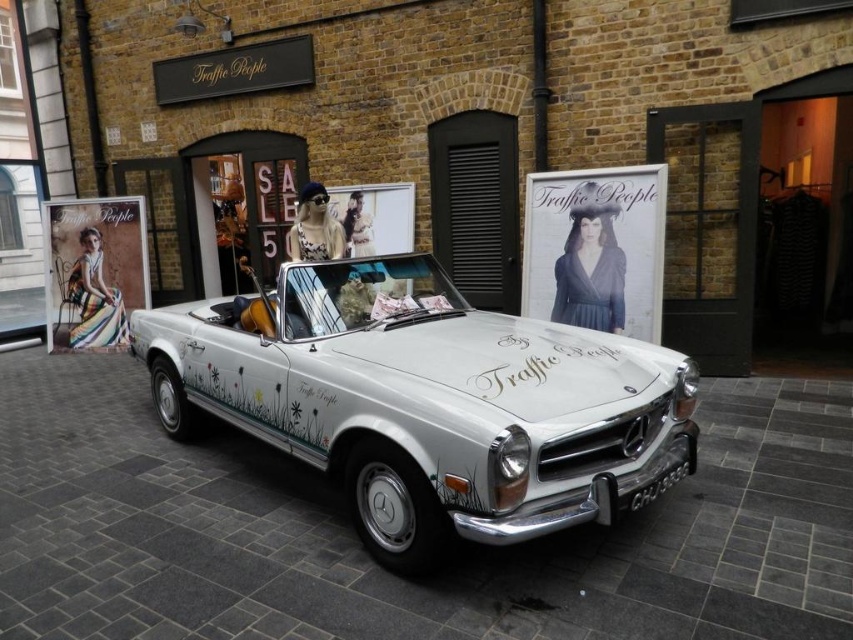
Is matte black poster at upper right positioned behind black plastic license plate at center?

That is True.

Which is below, matte black poster at upper right or black plastic license plate at center?

Positioned lower is black plastic license plate at center.

Image resolution: width=853 pixels, height=640 pixels. Identify the location of matte black poster at upper right. (596, 248).

I want to click on matte black poster at upper right, so click(596, 248).

This screenshot has width=853, height=640. I want to click on white metallic car at center, so click(x=425, y=401).

Between white metallic car at center and black plastic license plate at center, which one has more height?

white metallic car at center is taller.

At what (x,y) coordinates should I click in order to perform the action: click on white metallic car at center. Please return your answer as a coordinate pair (x, y). The height and width of the screenshot is (640, 853). Looking at the image, I should click on (425, 401).

The width and height of the screenshot is (853, 640). In order to click on white metallic car at center in this screenshot , I will do `click(425, 401)`.

Does white metallic car at center lie behind multicolored fabric dress at left?

No, white metallic car at center is in front of multicolored fabric dress at left.

Is white metallic car at center below multicolored fabric dress at left?

Yes, white metallic car at center is below multicolored fabric dress at left.

Is point (339, 464) behind point (144, 300)?

No.

Identify the location of white metallic car at center. This screenshot has width=853, height=640. (425, 401).